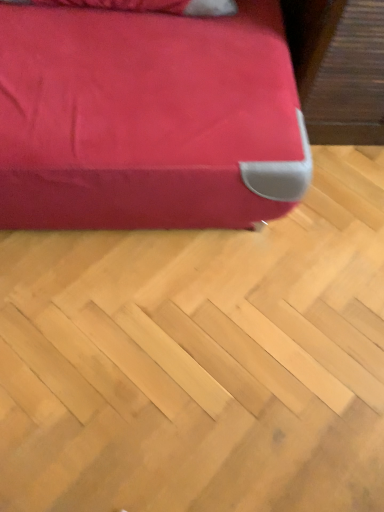
In order to click on matte red fabric at upper left in this screenshot , I will do `click(147, 118)`.

Measure the distance between matte red fabric at upper left and camera.

matte red fabric at upper left is 93.85 centimeters away from camera.

What do you see at coordinates (147, 118) in the screenshot?
I see `matte red fabric at upper left` at bounding box center [147, 118].

Where is `matte red fabric at upper left`? This screenshot has width=384, height=512. matte red fabric at upper left is located at coordinates (147, 118).